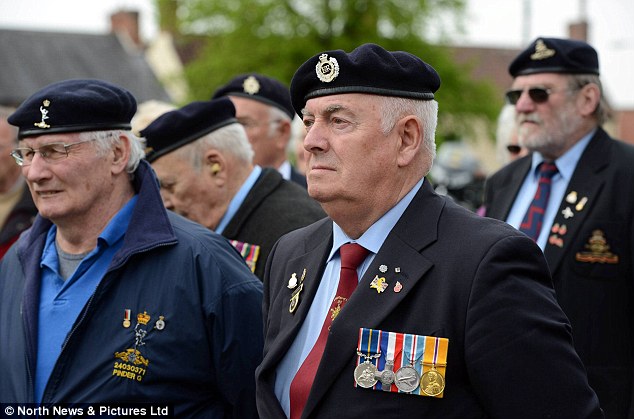
The image size is (634, 419). Identify the location of embroidered cloth. (131, 359), (602, 249).